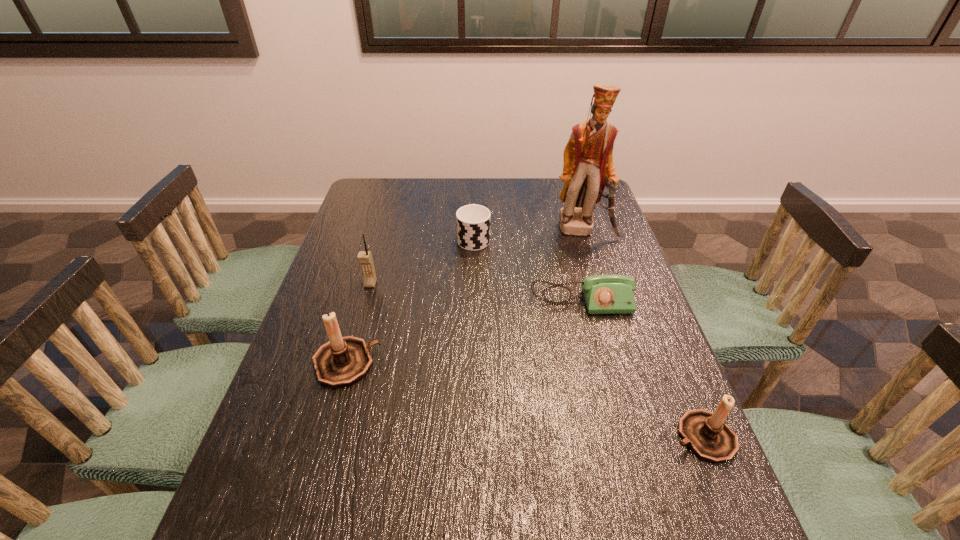
Find the location of a particular element. vacant point located between the fifth tallest object and the cellular telephone is located at coordinates (422, 261).

The width and height of the screenshot is (960, 540). Identify the location of vacant area between the cellular telephone and the fifth tallest object. [422, 261].

Identify the location of vacant region between the nearer candle holder and the third object from left to right. The image size is (960, 540). (588, 338).

In order to click on vacant space that is in between the nutcracker and the nearest object in this screenshot , I will do `click(644, 333)`.

I want to click on vacant area between the cup and the shortest object, so click(x=528, y=269).

Image resolution: width=960 pixels, height=540 pixels. Identify the location of free point between the cellular telephone and the telephone. (476, 292).

Locate an element on the screen. Image resolution: width=960 pixels, height=540 pixels. vacant point located between the fourth tallest object and the cellular telephone is located at coordinates (537, 360).

The image size is (960, 540). Identify the location of free space between the fifth farthest object and the cup. (410, 300).

Locate an element on the screen. The height and width of the screenshot is (540, 960). the closest object to the second nearest object is located at coordinates tap(365, 259).

Identify the location of object that is the closest to the nearer candle holder. (604, 294).